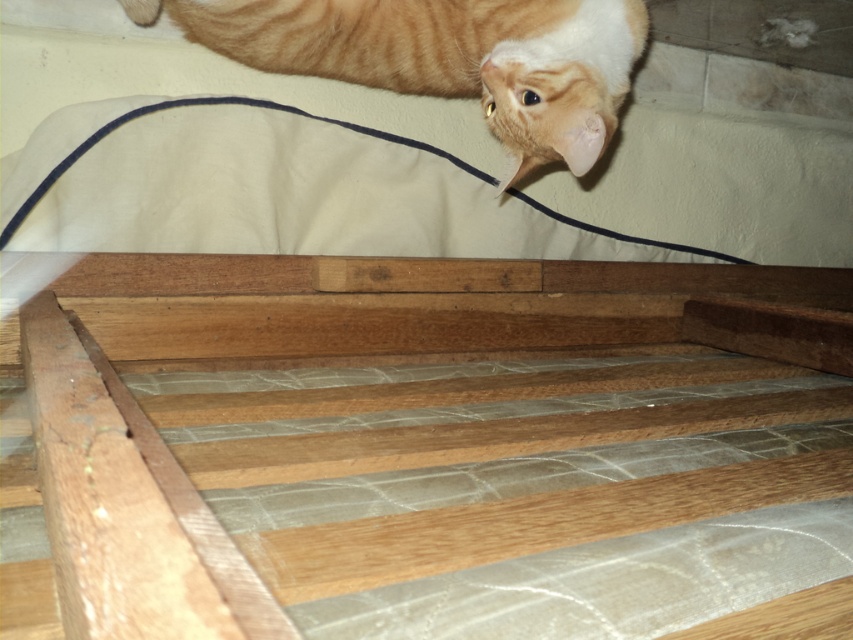
You are looking at the wooden bed frame with slats and the mattress. There is a point marked at coordinates (425, 449). Which object is this point located on?

The point at (425, 449) is located on the wooden slats at center.

You are looking at the wooden bed frame and notice two points marked on it. Which point is closer to you, point (672, 280) or point (553, 152)?

Point (672, 280) is closer to you than point (553, 152).

You are standing in front of the wooden bed frame and want to place a small decorative item exactly at the center of the wooden slats at center. According to the coordinates provided, where should you place the item?

The wooden slats at center are located at coordinates point (425, 449), so you should place the item there.